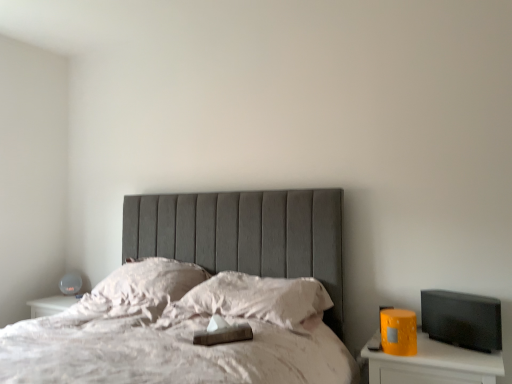
Question: Considering their positions, is white soft pillow at center, marked as the first pillow in a left-to-right arrangement, located in front of or behind matte white table lamp at left?

Choices:
 (A) front
 (B) behind

Answer: (A)

Question: Is point (163, 286) closer or farther from the camera than point (77, 286)?

Choices:
 (A) farther
 (B) closer

Answer: (B)

Question: Which is farther from the matte yellow nightstand at right?

Choices:
 (A) white soft pillow at center, arranged as the 2th pillow when viewed from the right
 (B) white soft pillow at center, which ranks as the first pillow in right-to-left order
 (C) matte white table lamp at left

Answer: (C)

Question: Estimate the real-world distances between objects in this image. Which object is farther from the white soft pillow at center, the 2th pillow when ordered from left to right?

Choices:
 (A) white soft pillow at center, marked as the first pillow in a left-to-right arrangement
 (B) matte white table lamp at left
 (C) matte yellow nightstand at right

Answer: (B)